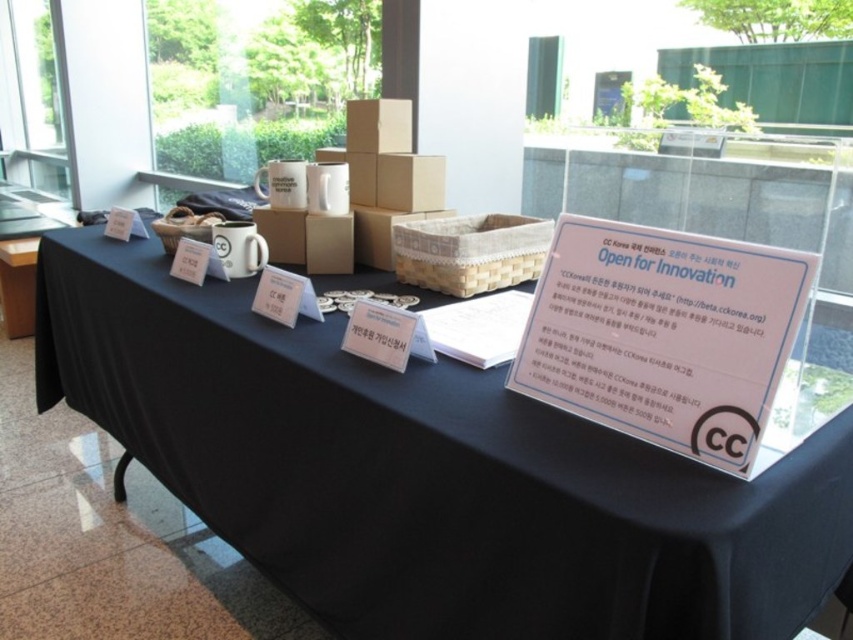
You are setting up for an event and need to place a decorative item between the black matte tablecloth at center and the white plastic sign at center. The decorative item requires a space of 1 foot. Is there enough space between them?

The black matte tablecloth at center is 12.84 inches away from the white plastic sign at center. Since 12.84 inches is approximately 1.07 feet, there is just enough space to place the decorative item between them.

You are setting up a booth at an event and need to place a decorative banner that is 2 meters wide. The banner must be placed on the black matte tablecloth at center or the white plastic sign at center. Based on their widths, which object can accommodate the banner without it hanging off the edge?

The black matte tablecloth at center is wider than the white plastic sign at center, so the banner should be placed on the black matte tablecloth at center to ensure it fits without hanging off the edge.

In the scene shown: You are setting up for an event and need to place a decorative item on the table. The decorative item is 1.2 meters tall. Can the black matte tablecloth at center support the height of the decorative item without it touching the white plastic sign at center?

The black matte tablecloth at center is taller than the white plastic sign at center. Since the decorative item is 1.2 meters tall, it can be placed on the black matte tablecloth at center without touching the white plastic sign at center as long as the tablecloth can accommodate the height.